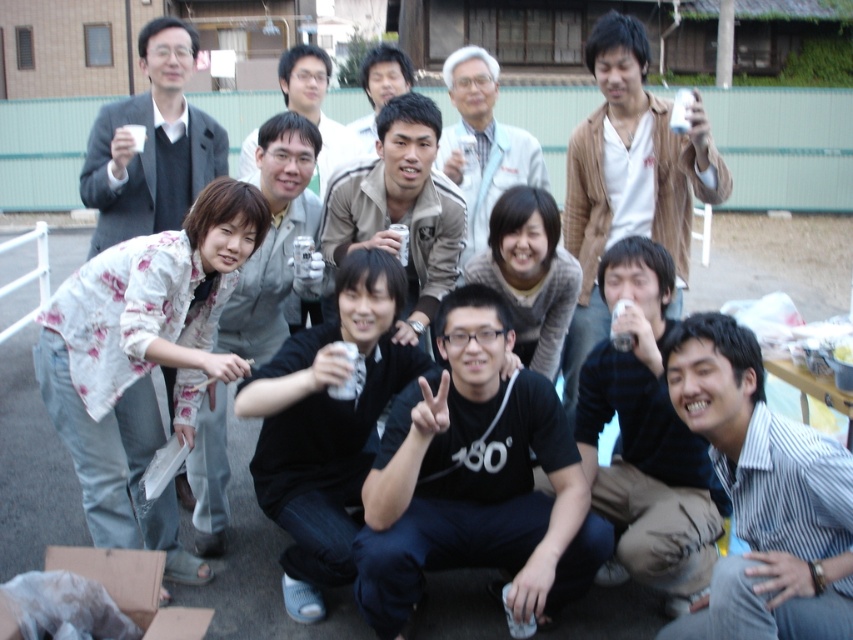
You are a photographer trying to capture a clear shot of both the black shirt at center and the light blue fabric shirt at center. Since you want both subjects in focus, which one should you adjust your camera focus to prioritize to ensure both are sharp?

To ensure both the black shirt at center and the light blue fabric shirt at center are in focus, prioritize focusing on the black shirt at center since it is closer to the viewer. This will allow the light blue fabric shirt at center, which is farther away, to still be within the depth of field.